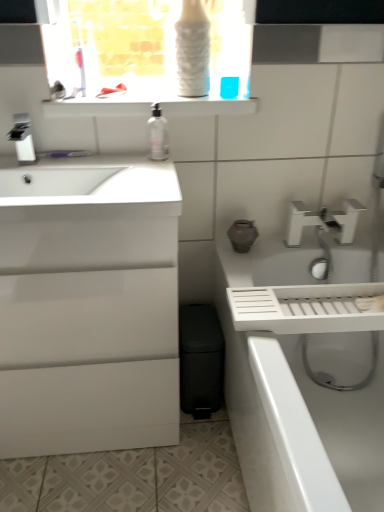
Find the location of a particular element. This screenshot has width=384, height=512. white glossy cabinet at left is located at coordinates (88, 306).

Image resolution: width=384 pixels, height=512 pixels. I want to click on white glossy shelf at upper center, so click(97, 106).

Locate an element on the screen. Image resolution: width=384 pixels, height=512 pixels. clear plastic bottle at center is located at coordinates (158, 135).

Find the location of `white glossy bath at right`. white glossy bath at right is located at coordinates (300, 382).

Based on the photo, is satin nickel faucet at upper left, the 1th tap viewed from the left, behind white glossy shelf at upper center?

No, satin nickel faucet at upper left, the 1th tap viewed from the left, is in front of white glossy shelf at upper center.

From a real-world perspective, between satin nickel faucet at upper left, marked as the first tap in a top-to-bottom arrangement, and white glossy shelf at upper center, who is vertically lower?

satin nickel faucet at upper left, marked as the first tap in a top-to-bottom arrangement, is physically lower.

Considering the relative sizes of satin nickel faucet at upper left, marked as the first tap in a top-to-bottom arrangement, and white glossy shelf at upper center in the image provided, is satin nickel faucet at upper left, marked as the first tap in a top-to-bottom arrangement, smaller than white glossy shelf at upper center?

Indeed, satin nickel faucet at upper left, marked as the first tap in a top-to-bottom arrangement, has a smaller size compared to white glossy shelf at upper center.

Considering the positions of points (18, 144) and (88, 116), is point (18, 144) closer to camera compared to point (88, 116)?

Yes.

From the image's perspective, is white glossy faucet at upper right, arranged as the 1th tap when viewed from the right, on white glossy shelf at upper center?

Actually, white glossy faucet at upper right, arranged as the 1th tap when viewed from the right, appears below white glossy shelf at upper center in the image.

From the picture: Is white glossy faucet at upper right, which is counted as the 2th tap, starting from the front, bigger or smaller than white glossy shelf at upper center?

Considering their sizes, white glossy faucet at upper right, which is counted as the 2th tap, starting from the front, takes up less space than white glossy shelf at upper center.

Can you confirm if white glossy faucet at upper right, which is counted as the 2th tap, starting from the front, is thinner than white glossy shelf at upper center?

Yes, white glossy faucet at upper right, which is counted as the 2th tap, starting from the front, is thinner than white glossy shelf at upper center.

Could you measure the distance between white glossy faucet at upper right, the 2th tap positioned from the top, and white glossy shelf at upper center?

They are 19.61 inches apart.

From a real-world perspective, between clear plastic bottle at center and white glossy cabinet at left, who is vertically lower?

white glossy cabinet at left, from a real-world perspective.

Consider the image. Is clear plastic bottle at center wider than white glossy cabinet at left?

In fact, clear plastic bottle at center might be narrower than white glossy cabinet at left.

Is clear plastic bottle at center positioned behind white glossy cabinet at left?

Yes, clear plastic bottle at center is further from the viewer.

Is clear plastic bottle at center situated inside white glossy cabinet at left or outside?

clear plastic bottle at center is located beyond the bounds of white glossy cabinet at left.

Consider the image. Is white glossy faucet at upper right, arranged as the 1th tap when viewed from the right, wider than satin nickel faucet at upper left, placed as the second tap when sorted from right to left?

In fact, white glossy faucet at upper right, arranged as the 1th tap when viewed from the right, might be narrower than satin nickel faucet at upper left, placed as the second tap when sorted from right to left.

From the picture: Between white glossy faucet at upper right, arranged as the 1th tap when viewed from the right, and satin nickel faucet at upper left, placed as the second tap when sorted from right to left, which one has smaller size?

satin nickel faucet at upper left, placed as the second tap when sorted from right to left.

From the image's perspective, is white glossy faucet at upper right, the 2th tap positioned from the top, above satin nickel faucet at upper left, which ranks as the second tap in bottom-to-top order?

No.

Which is in front, point (15, 208) or point (324, 429)?

The point (15, 208) is more forward.

Which is correct: white glossy cabinet at left is inside white glossy bath at right, or outside of it?

white glossy cabinet at left is not inside white glossy bath at right, it's outside.

From the image's perspective, does white glossy cabinet at left appear higher than white glossy bath at right?

Yes, from the image's perspective, white glossy cabinet at left is on top of white glossy bath at right.

Which object is positioned more to the right, white glossy cabinet at left or white glossy bath at right?

white glossy bath at right is more to the right.

Is white glossy cabinet at left wider than clear plastic bottle at center?

Correct, the width of white glossy cabinet at left exceeds that of clear plastic bottle at center.

Which is in front, white glossy cabinet at left or clear plastic bottle at center?

Positioned in front is white glossy cabinet at left.

Is white glossy cabinet at left smaller than clear plastic bottle at center?

Incorrect, white glossy cabinet at left is not smaller in size than clear plastic bottle at center.

Identify the location of bathroom cabinet that appears below the clear plastic bottle at center (from the image's perspective). (88, 306).

Is white glossy shelf at upper center facing towards satin nickel faucet at upper left, which ranks as the second tap in bottom-to-top order?

No, white glossy shelf at upper center is not oriented towards satin nickel faucet at upper left, which ranks as the second tap in bottom-to-top order.

Looking at this image, is white glossy shelf at upper center closer to the viewer compared to satin nickel faucet at upper left, arranged as the 1th tap when viewed from the front?

No, it is behind satin nickel faucet at upper left, arranged as the 1th tap when viewed from the front.

Can you tell me how much white glossy shelf at upper center and satin nickel faucet at upper left, arranged as the 2th tap when viewed from the back, differ in facing direction?

The angle between the facing direction of white glossy shelf at upper center and the facing direction of satin nickel faucet at upper left, arranged as the 2th tap when viewed from the back, is 0.000742 degrees.

Identify the location of window sill on the right of satin nickel faucet at upper left, arranged as the 1th tap when viewed from the front. This screenshot has width=384, height=512. (97, 106).

Where is `the 1st tap positioned below the white glossy shelf at upper center (from the image's perspective)`? This screenshot has width=384, height=512. the 1st tap positioned below the white glossy shelf at upper center (from the image's perspective) is located at coordinates (22, 138).

You are a GUI agent. You are given a task and a screenshot of the screen. Output one action in this format:
    pyautogui.click(x=<x>, y=<y>)
    Task: Click on the tap behind the white glossy shelf at upper center
    
    Given the screenshot: What is the action you would take?
    pyautogui.click(x=323, y=221)

Looking at the image, which one is located further to clear plastic bottle at center, satin nickel faucet at upper left, arranged as the 2th tap when viewed from the back, or white glossy faucet at upper right, positioned as the 2th tap in left-to-right order?

white glossy faucet at upper right, positioned as the 2th tap in left-to-right order, is positioned further to the anchor clear plastic bottle at center.

Which object lies further to the anchor point white glossy cabinet at left, white glossy bath at right or satin nickel faucet at upper left, arranged as the 2th tap when viewed from the back?

Based on the image, satin nickel faucet at upper left, arranged as the 2th tap when viewed from the back, appears to be further to white glossy cabinet at left.

Based on their spatial positions, is white glossy bath at right or white glossy cabinet at left closer to white glossy shelf at upper center?

white glossy cabinet at left.

When comparing their distances from white glossy faucet at upper right, positioned as the 2th tap in left-to-right order, does white glossy cabinet at left or clear plastic bottle at center seem closer?

clear plastic bottle at center lies closer to white glossy faucet at upper right, positioned as the 2th tap in left-to-right order, than the other object.

Considering their positions, is satin nickel faucet at upper left, which ranks as the second tap in bottom-to-top order, positioned closer to white glossy shelf at upper center than white glossy faucet at upper right, positioned as the 2th tap in left-to-right order?

satin nickel faucet at upper left, which ranks as the second tap in bottom-to-top order, lies closer to white glossy shelf at upper center than the other object.

Estimate the real-world distances between objects in this image. Which object is further from white glossy shelf at upper center, clear plastic bottle at center or satin nickel faucet at upper left, which ranks as the second tap in bottom-to-top order?

satin nickel faucet at upper left, which ranks as the second tap in bottom-to-top order, is positioned further to the anchor white glossy shelf at upper center.

Considering their positions, is white glossy faucet at upper right, positioned as the 2th tap in left-to-right order, positioned closer to white glossy cabinet at left than white glossy shelf at upper center?

The object closer to white glossy cabinet at left is white glossy shelf at upper center.

Estimate the real-world distances between objects in this image. Which object is further from white glossy cabinet at left, satin nickel faucet at upper left, placed as the second tap when sorted from right to left, or white glossy faucet at upper right, which is counted as the 2th tap, starting from the front?

white glossy faucet at upper right, which is counted as the 2th tap, starting from the front, lies further to white glossy cabinet at left than the other object.

Image resolution: width=384 pixels, height=512 pixels. Find the location of `window sill between satin nickel faucet at upper left, arranged as the 1th tap when viewed from the front, and white glossy faucet at upper right, the first tap when ordered from back to front, in the horizontal direction`. window sill between satin nickel faucet at upper left, arranged as the 1th tap when viewed from the front, and white glossy faucet at upper right, the first tap when ordered from back to front, in the horizontal direction is located at coordinates (97, 106).

The height and width of the screenshot is (512, 384). Find the location of `window sill situated between satin nickel faucet at upper left, which ranks as the second tap in bottom-to-top order, and white glossy bath at right from left to right`. window sill situated between satin nickel faucet at upper left, which ranks as the second tap in bottom-to-top order, and white glossy bath at right from left to right is located at coordinates (97, 106).

Locate an element on the screen. tap located between satin nickel faucet at upper left, placed as the second tap when sorted from right to left, and white glossy bath at right in the left-right direction is located at coordinates (323, 221).

Image resolution: width=384 pixels, height=512 pixels. Identify the location of soap dispenser located between white glossy shelf at upper center and white glossy faucet at upper right, arranged as the 1th tap when viewed from the right, in the left-right direction. (158, 135).